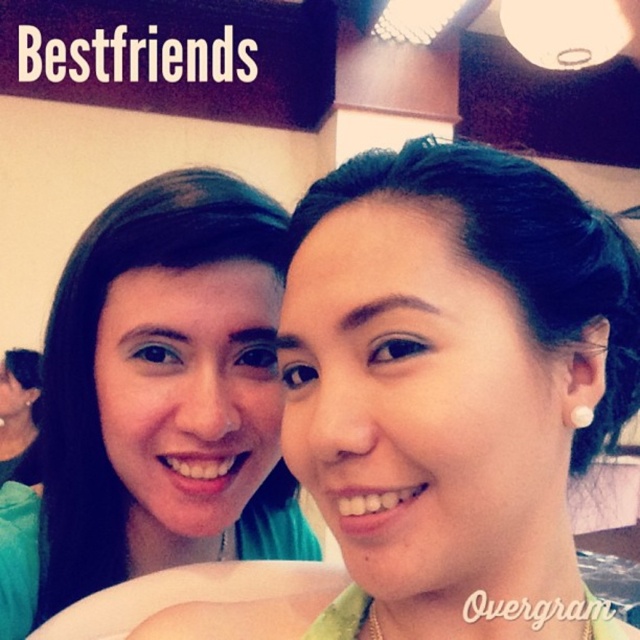
Question: Does matte green shirt at center have a larger size compared to matte green shirt at left?

Choices:
 (A) yes
 (B) no

Answer: (B)

Question: Is the position of matte green shirt at center more distant than that of matte green shirt at left?

Choices:
 (A) no
 (B) yes

Answer: (A)

Question: Among these points, which one is nearest to the camera?

Choices:
 (A) (477, 545)
 (B) (45, 493)

Answer: (A)

Question: Which point is farther to the camera?

Choices:
 (A) matte green shirt at center
 (B) matte green shirt at left

Answer: (B)

Question: Does matte green shirt at center appear on the left side of matte green shirt at left?

Choices:
 (A) no
 (B) yes

Answer: (A)